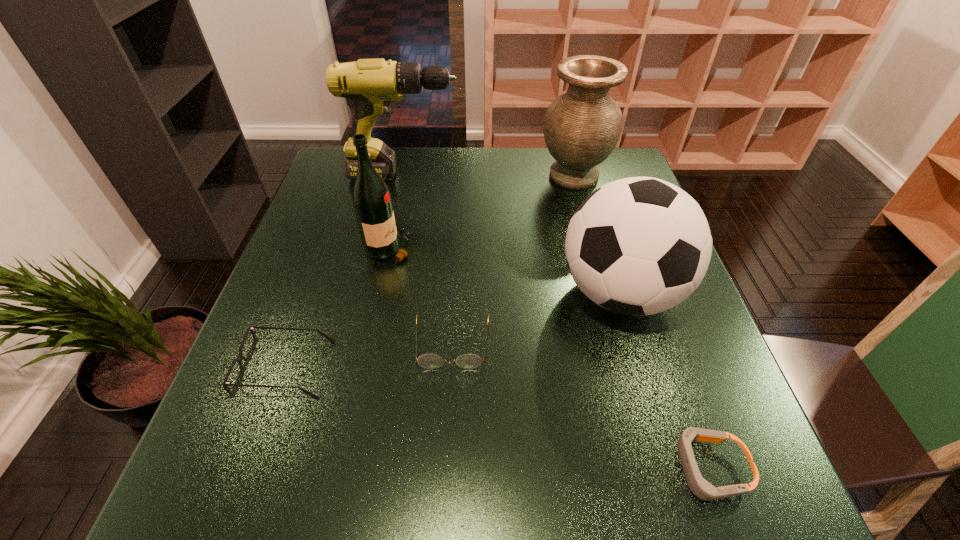
Image resolution: width=960 pixels, height=540 pixels. What are the coordinates of `free location at the left edge` in the screenshot? It's located at (276, 330).

Where is `free location at the right edge`? free location at the right edge is located at coordinates (633, 324).

The width and height of the screenshot is (960, 540). I want to click on free space at the far right corner of the desktop, so (x=620, y=161).

Identify the location of free space between the nearest object and the drill. The width and height of the screenshot is (960, 540). (557, 321).

Identify the location of free space between the vase and the drill. (489, 176).

In order to click on free point between the drill and the soccer ball in this screenshot , I will do click(x=512, y=234).

Find the location of a particular element. unoccupied position between the wine bottle and the right spectacles is located at coordinates (421, 296).

Identify the location of free space between the soccer ball and the shortest object. (664, 380).

This screenshot has height=540, width=960. In order to click on vacant area that lies between the right spectacles and the goggles in this screenshot , I will do `click(581, 406)`.

In order to click on vacant space that is in between the soccer ball and the left spectacles in this screenshot , I will do `click(453, 331)`.